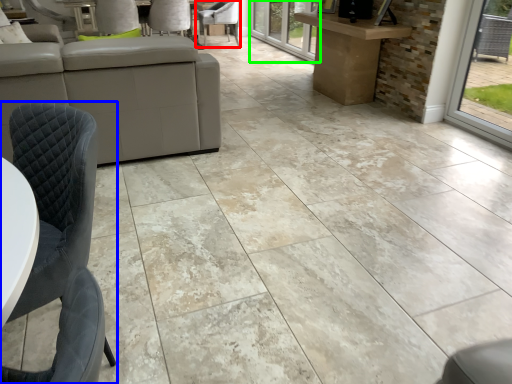
Question: Estimate the real-world distances between objects in this image. Which object is farther from chair (highlighted by a red box), chair (highlighted by a blue box) or glass door (highlighted by a green box)?

Choices:
 (A) chair
 (B) glass door

Answer: (A)